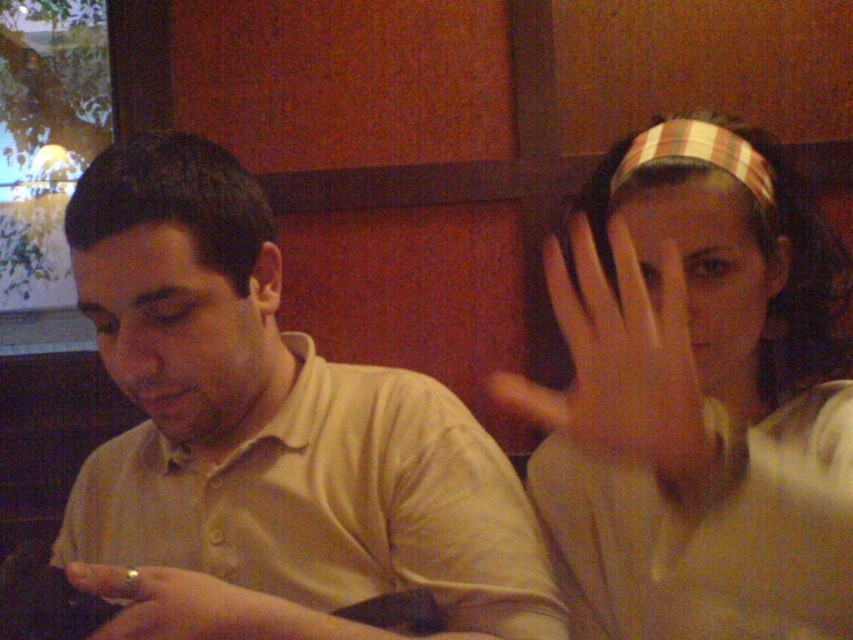
Question: Is striped fabric headband at upper right below gold ring at lower left?

Choices:
 (A) yes
 (B) no

Answer: (B)

Question: Which point appears farthest from the camera in this image?

Choices:
 (A) (149, 577)
 (B) (796, 616)

Answer: (A)

Question: Is beige cotton shirt at left positioned behind gold ring at lower left?

Choices:
 (A) yes
 (B) no

Answer: (B)

Question: Which of the following is the closest to the observer?

Choices:
 (A) (614, 422)
 (B) (158, 579)
 (C) (653, 472)
 (D) (267, 445)

Answer: (A)

Question: Is beige cotton shirt at left thinner than striped fabric headband at upper right?

Choices:
 (A) no
 (B) yes

Answer: (A)

Question: Which of the following is the farthest from the observer?

Choices:
 (A) (730, 483)
 (B) (492, 596)

Answer: (B)